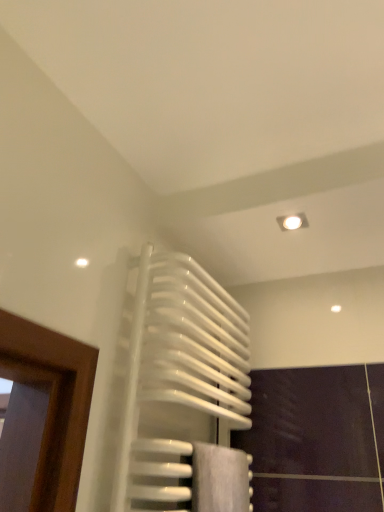
Describe the element at coordinates (177, 379) in the screenshot. I see `white glossy radiator at center` at that location.

What is the approximate width of white glossy radiator at center?

white glossy radiator at center is 6.95 inches wide.

Locate an element on the screen. Image resolution: width=384 pixels, height=512 pixels. white glossy radiator at center is located at coordinates (177, 379).

I want to click on white glossy radiator at center, so click(x=177, y=379).